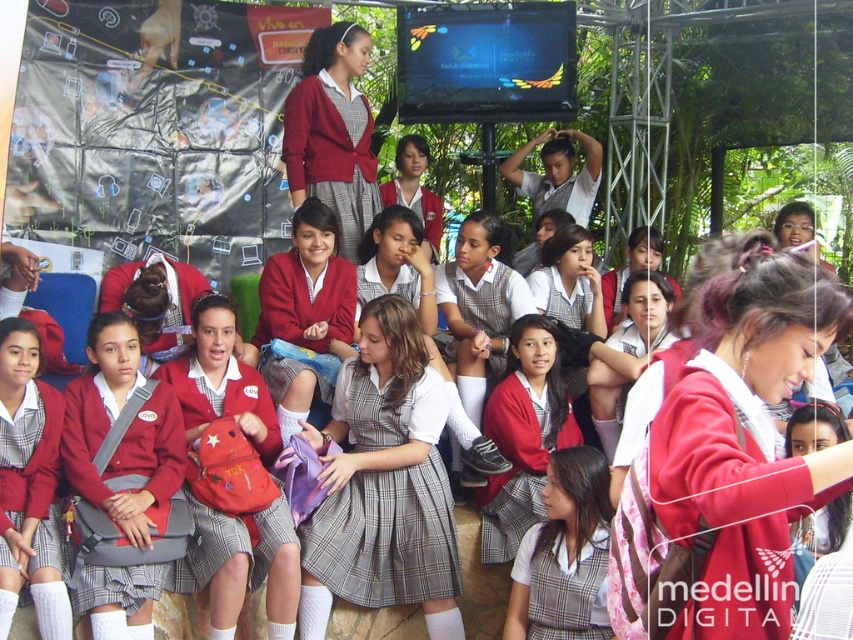
Question: Where is plaid cotton dress at center located in relation to plaid fabric skirt at center in the image?

Choices:
 (A) below
 (B) above

Answer: (B)

Question: Is plaid cotton dress at center to the right of plaid fabric skirt at center from the viewer's perspective?

Choices:
 (A) yes
 (B) no

Answer: (B)

Question: Can you confirm if plaid cotton dress at center is bigger than plaid fabric skirt at center?

Choices:
 (A) yes
 (B) no

Answer: (B)